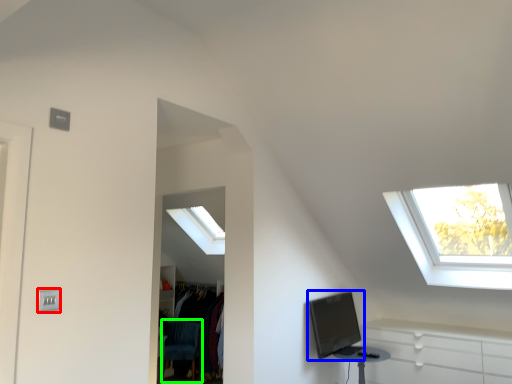
Question: Based on their relative distances, which object is nearer to electric outlet (highlighted by a red box)? Choose from computer monitor (highlighted by a blue box) and swivel chair (highlighted by a green box).

Choices:
 (A) computer monitor
 (B) swivel chair

Answer: (A)